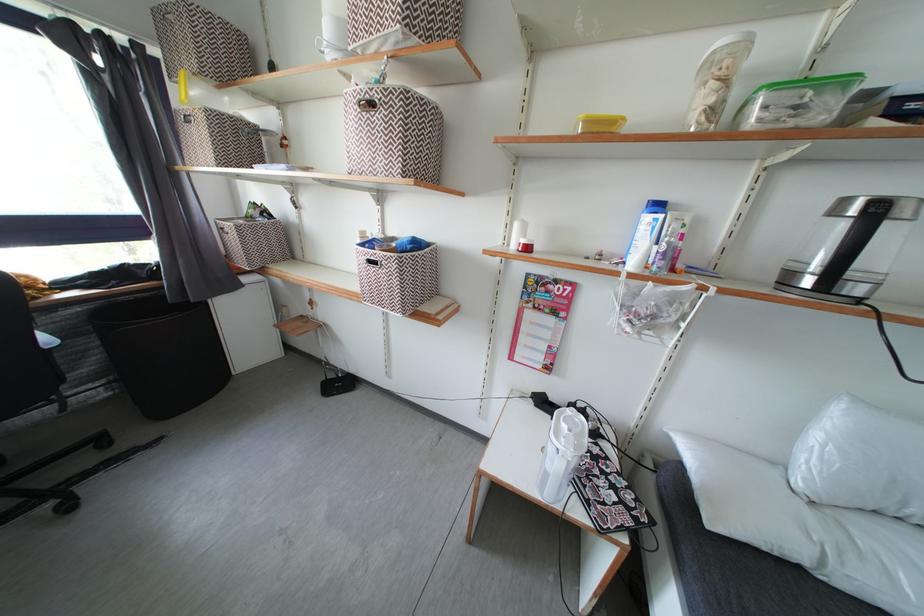
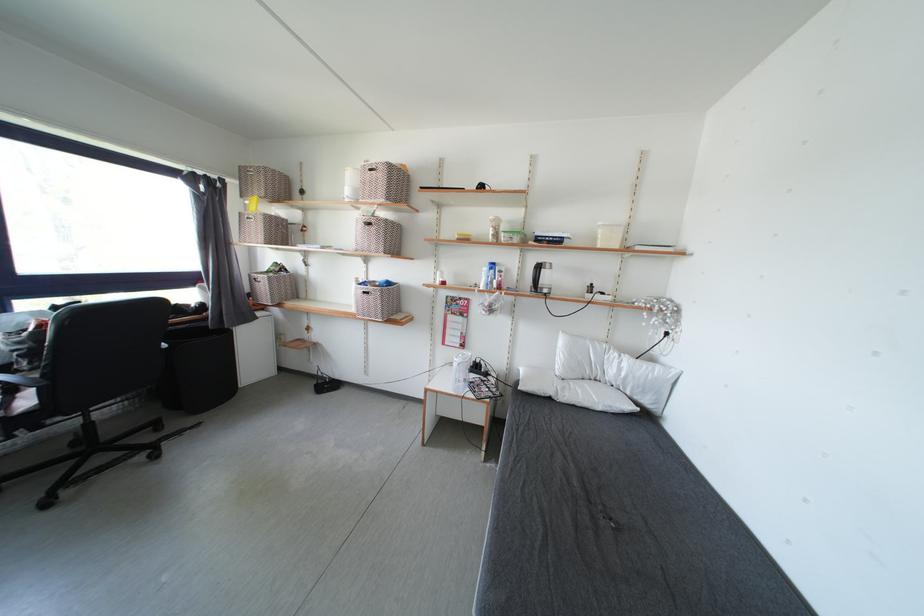
In the second image, find the point that corresponds to (x=803, y=573) in the first image.

(556, 403)